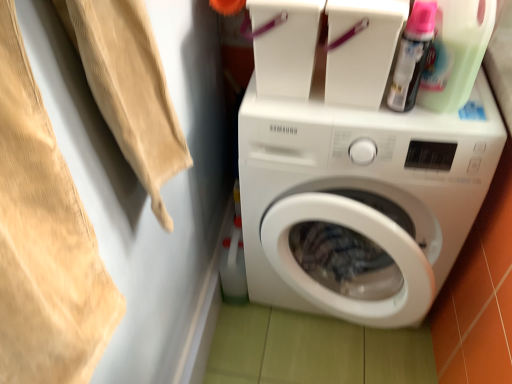
What are the coordinates of `vacant space in front of green translucent bottle at upper right, placed as the 2th cleaning product when sorted from left to right` in the screenshot? It's located at (450, 126).